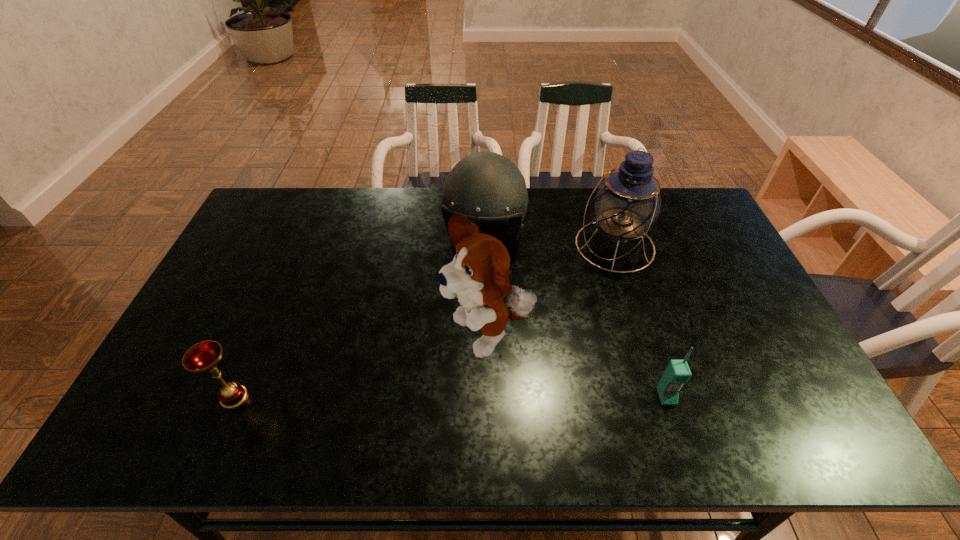
At what (x,y) coordinates should I click in order to perform the action: click on vacant space situated 0.100m on the face of the third nearest object. Please return your answer as a coordinate pair (x, y). The image size is (960, 540). Looking at the image, I should click on (x=421, y=387).

You are a GUI agent. You are given a task and a screenshot of the screen. Output one action in this format:
    pyautogui.click(x=<x>, y=<y>)
    Task: Click on the free space located 0.100m on the face of the third nearest object
    
    Given the screenshot: What is the action you would take?
    pyautogui.click(x=421, y=387)

The image size is (960, 540). Identify the location of free spot located at the face opening of the third tallest object. (472, 293).

This screenshot has width=960, height=540. Identify the location of vacant space located 0.060m at the face opening of the third tallest object. (475, 279).

Where is `free space located at the face opening of the third tallest object`? The height and width of the screenshot is (540, 960). free space located at the face opening of the third tallest object is located at coordinates (465, 325).

You are a GUI agent. You are given a task and a screenshot of the screen. Output one action in this format:
    pyautogui.click(x=<x>, y=<y>)
    Task: Click on the lantern present at the far edge
    
    Given the screenshot: What is the action you would take?
    pyautogui.click(x=627, y=203)

Locate an element on the screen. football helmet that is at the far edge is located at coordinates (485, 186).

In order to click on chalice situated at the near edge in this screenshot , I will do `click(203, 357)`.

I want to click on cellular telephone that is at the near edge, so (677, 373).

Image resolution: width=960 pixels, height=540 pixels. Find the location of `puppy that is at the near edge`. puppy that is at the near edge is located at coordinates (478, 276).